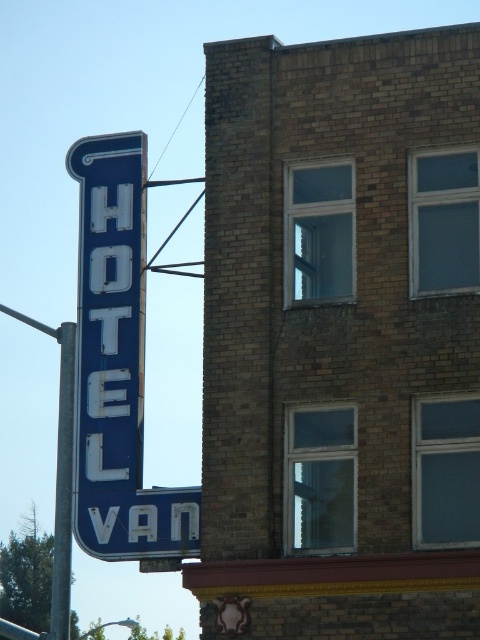
This screenshot has height=640, width=480. Describe the element at coordinates (117, 365) in the screenshot. I see `blue metallic sign at left` at that location.

Is point (169, 525) less distant than point (60, 464)?

Yes.

Where is `blue metallic sign at left`? This screenshot has height=640, width=480. blue metallic sign at left is located at coordinates (117, 365).